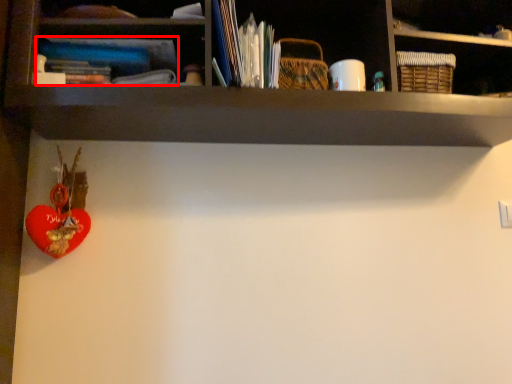
Question: From the image's perspective, considering the relative positions of book (annotated by the red box) and toy in the image provided, where is book (annotated by the red box) located with respect to the staircase?

Choices:
 (A) below
 (B) above

Answer: (B)